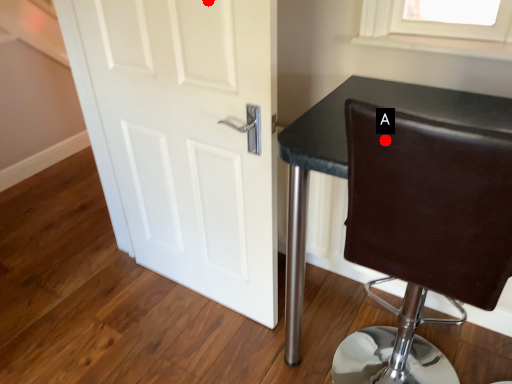
Question: Two points are circled on the image, labeled by A and B beside each circle. Among these points, which one is farthest from the camera?

Choices:
 (A) A is further
 (B) B is further

Answer: (B)